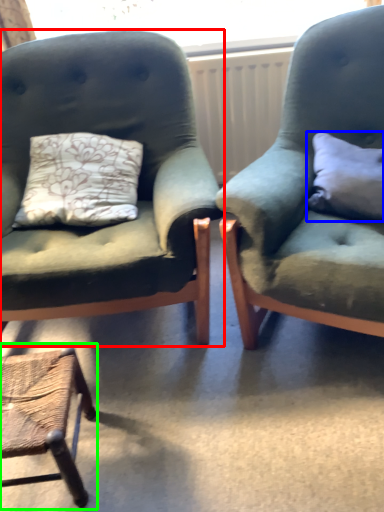
Question: Based on their relative distances, which object is farther from chair (highlighted by a red box)? Choose from pillow (highlighted by a blue box) and chair (highlighted by a green box).

Choices:
 (A) pillow
 (B) chair

Answer: (A)